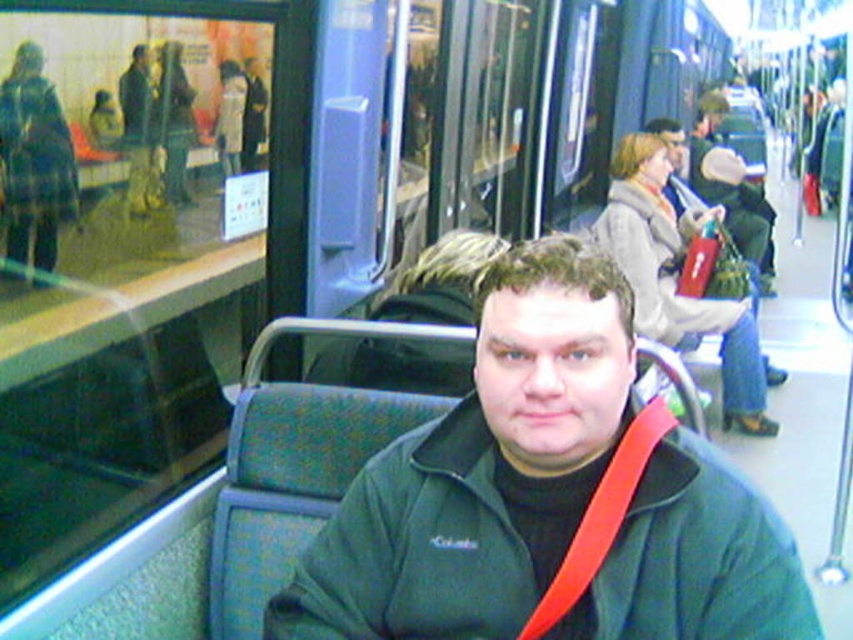
Can you confirm if green fleece jacket at center is positioned to the left of red fabric seatbelt at center?

Indeed, green fleece jacket at center is positioned on the left side of red fabric seatbelt at center.

Can you confirm if green fleece jacket at center is positioned below red fabric seatbelt at center?

Yes.

Does point (712, 538) lie behind point (621, 484)?

No, it is in front of (621, 484).

At what (x,y) coordinates should I click in order to perform the action: click on green fleece jacket at center. Please return your answer as a coordinate pair (x, y). Looking at the image, I should click on (549, 496).

Which is in front, point (412, 568) or point (672, 163)?

Positioned in front is point (412, 568).

How far apart are green fleece jacket at center and matte green jacket at center?

A distance of 12.03 feet exists between green fleece jacket at center and matte green jacket at center.

This screenshot has height=640, width=853. What do you see at coordinates (549, 496) in the screenshot? I see `green fleece jacket at center` at bounding box center [549, 496].

Where is `green fleece jacket at center`? This screenshot has height=640, width=853. green fleece jacket at center is located at coordinates (549, 496).

Is red fabric seatbelt at center to the right of matte green jacket at center from the viewer's perspective?

In fact, red fabric seatbelt at center is to the left of matte green jacket at center.

Between point (612, 496) and point (733, 244), which one is positioned in front?

Point (612, 496)

Between point (616, 515) and point (688, 157), which one is positioned behind?

The point (688, 157) is more distant.

Where is `red fabric seatbelt at center`? The width and height of the screenshot is (853, 640). red fabric seatbelt at center is located at coordinates (601, 516).